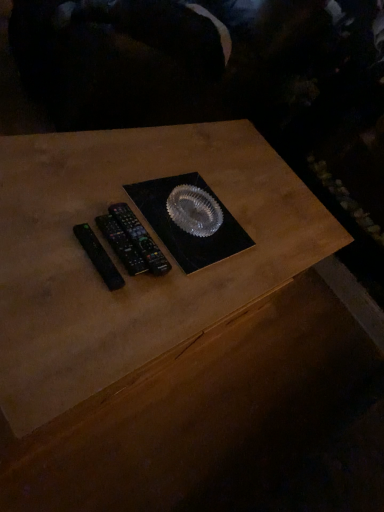
This screenshot has width=384, height=512. What are the coordinates of `unoccupied region to the right of black plastic remote at left, the second control from the back` in the screenshot? It's located at (177, 298).